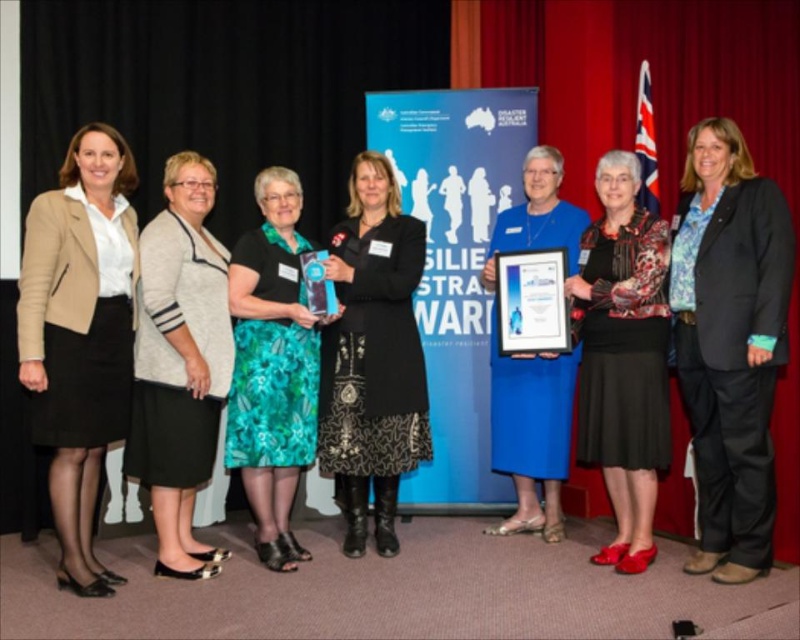
Who is more distant from viewer, (76, 308) or (306, 445)?

The point (306, 445) is more distant.

Is point (57, 387) farther from viewer compared to point (292, 307)?

No, it is in front of (292, 307).

At what (x,y) coordinates should I click in order to perform the action: click on beige fabric blazer at left. Please return your answer as a coordinate pair (x, y). Looking at the image, I should click on (80, 336).

Who is higher up, black fabric jacket at center or light gray knit cardigan at center?

black fabric jacket at center is above.

Is point (700, 474) behind point (168, 308)?

Yes, it is behind point (168, 308).

Locate an element on the screen. black fabric jacket at center is located at coordinates (730, 342).

Does black fabric jacket at center appear over black textured dress at center?

Yes.

Is point (756, 458) positioned after point (404, 308)?

No, (756, 458) is in front of (404, 308).

Find the location of a particular element. black fabric jacket at center is located at coordinates (730, 342).